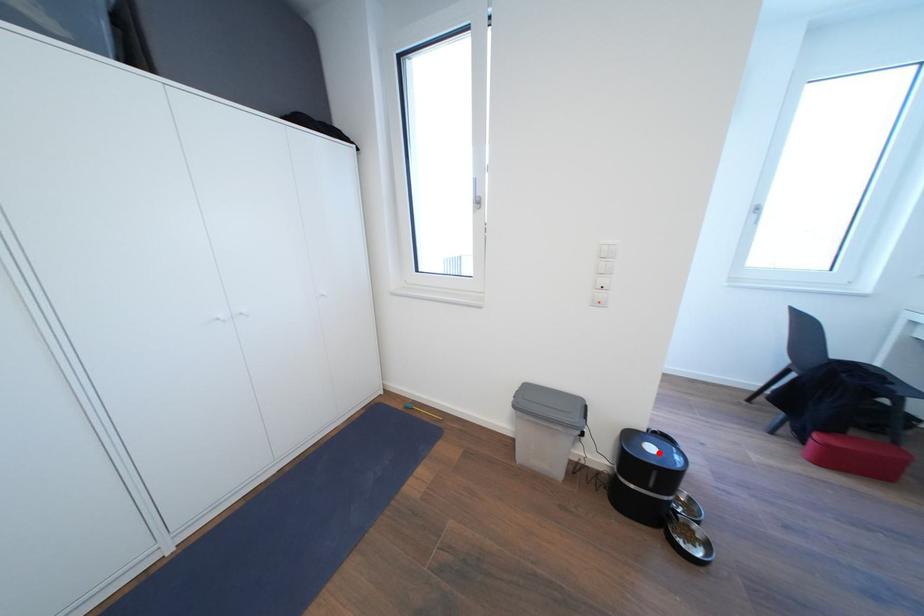
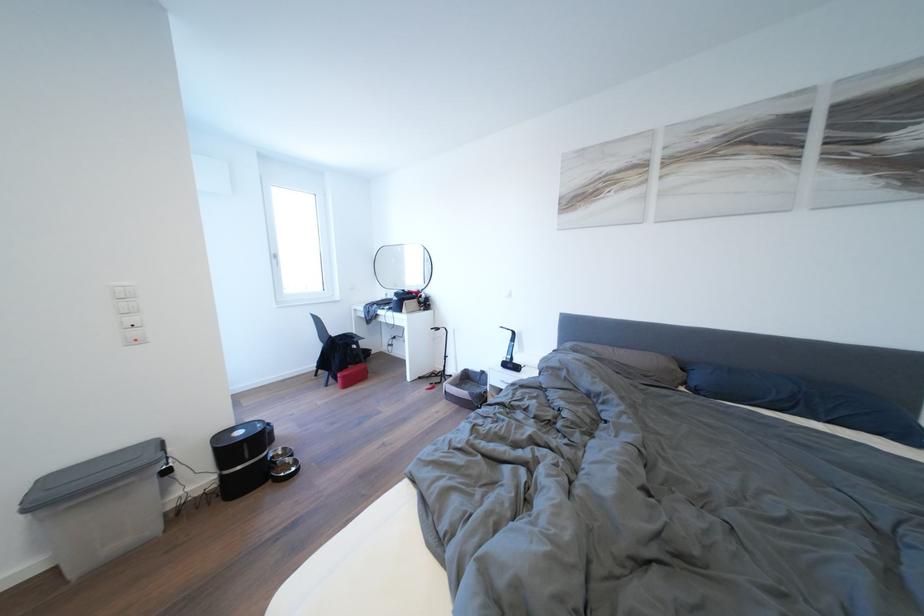
Find the pixel in the second image that matches the highlighted location in the first image.

(248, 438)